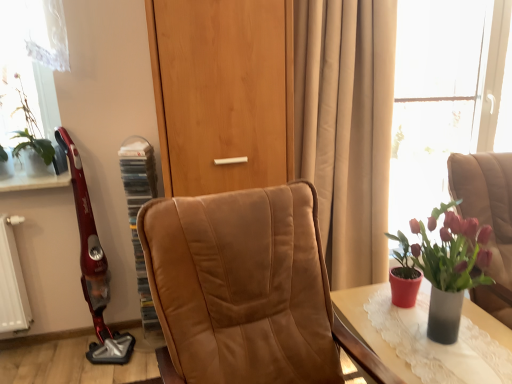
Question: Should I look upward or downward to see green leafy plant at upper left, which is the 2th houseplant in front-to-back order?

Choices:
 (A) down
 (B) up

Answer: (B)

Question: From a real-world perspective, is transparent glass window at upper right located higher than matte gray table at lower right?

Choices:
 (A) no
 (B) yes

Answer: (B)

Question: Is the position of transparent glass window at upper right less distant than that of matte gray table at lower right?

Choices:
 (A) no
 (B) yes

Answer: (A)

Question: Considering the relative sizes of transparent glass window at upper right and matte gray table at lower right in the image provided, is transparent glass window at upper right bigger than matte gray table at lower right?

Choices:
 (A) yes
 (B) no

Answer: (B)

Question: Does transparent glass window at upper right have a smaller size compared to matte gray table at lower right?

Choices:
 (A) no
 (B) yes

Answer: (B)

Question: Is transparent glass window at upper right facing away from matte gray table at lower right?

Choices:
 (A) no
 (B) yes

Answer: (A)

Question: Can you confirm if transparent glass window at upper right is thinner than matte gray table at lower right?

Choices:
 (A) yes
 (B) no

Answer: (A)

Question: Is there a large distance between wooden door at center and purple matte vase at right, marked as the first houseplant in a right-to-left arrangement?

Choices:
 (A) yes
 (B) no

Answer: (B)

Question: Is wooden door at center oriented towards purple matte vase at right, marked as the first houseplant in a right-to-left arrangement?

Choices:
 (A) yes
 (B) no

Answer: (B)

Question: Is wooden door at center wider than purple matte vase at right, which ranks as the 2th houseplant in left-to-right order?

Choices:
 (A) no
 (B) yes

Answer: (B)

Question: Is wooden door at center turned away from purple matte vase at right, which is the first houseplant from front to back?

Choices:
 (A) no
 (B) yes

Answer: (A)

Question: Can you confirm if wooden door at center is bigger than purple matte vase at right, marked as the first houseplant in a right-to-left arrangement?

Choices:
 (A) yes
 (B) no

Answer: (A)

Question: Can we say wooden door at center lies outside purple matte vase at right, marked as the 2th houseplant in a back-to-front arrangement?

Choices:
 (A) yes
 (B) no

Answer: (A)

Question: Is wooden door at center thinner than beige fabric curtain at center?

Choices:
 (A) no
 (B) yes

Answer: (A)